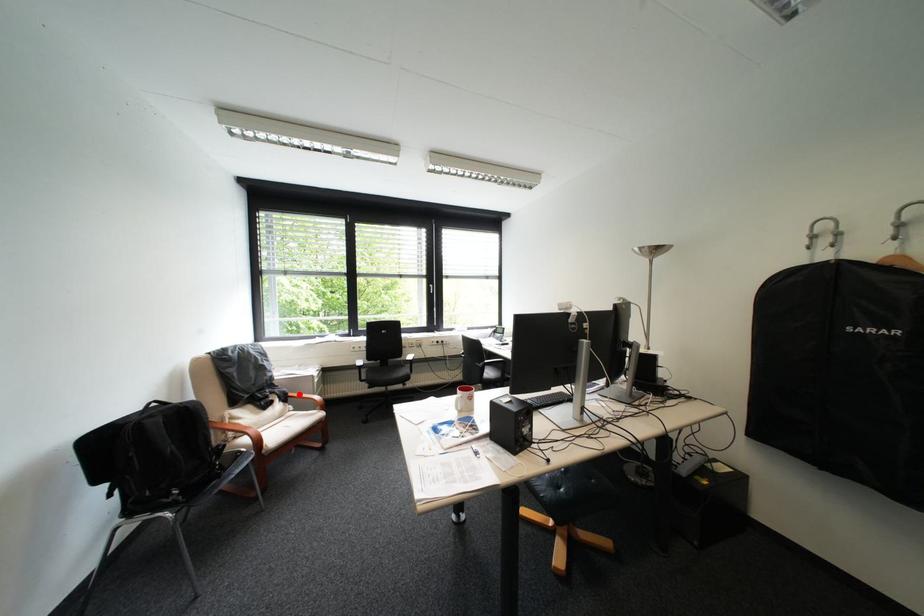
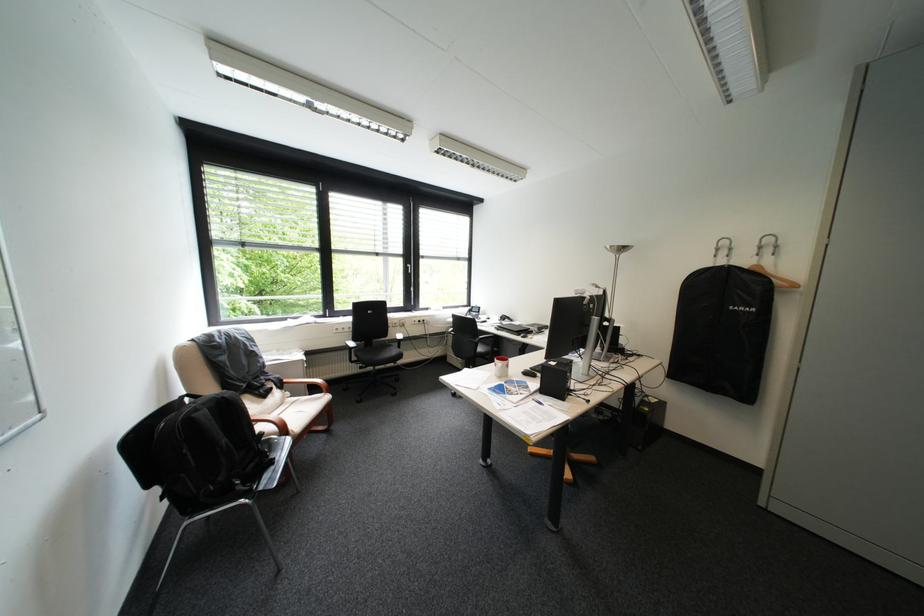
Question: I am providing you with two images of the same scene from different viewpoints. Image1 has a red point marked. In image2, the corresponding 3D location appears at what relative position? Reply with the corresponding letter.

Choices:
 (A) Closer
 (B) Farther

Answer: (A)